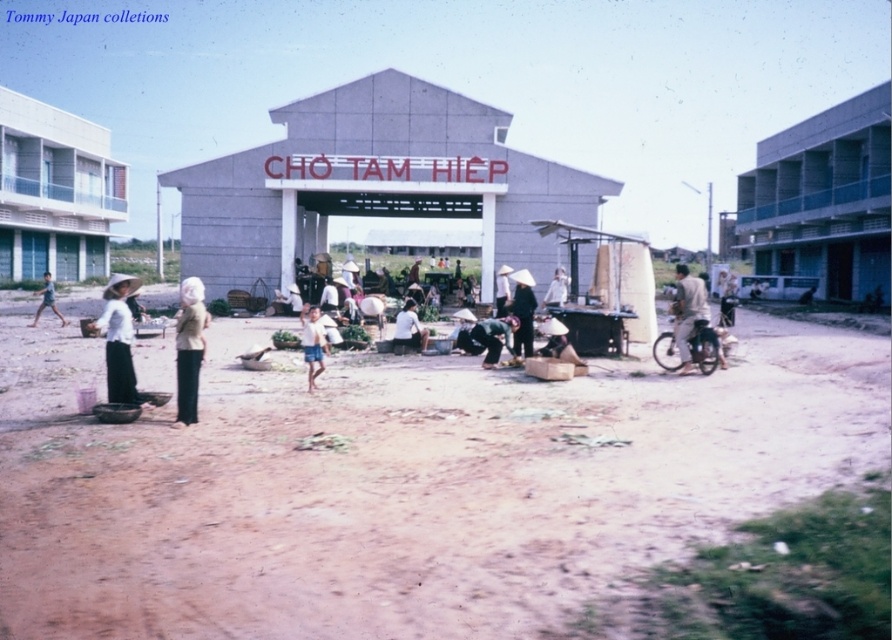
Question: Is brown dirt field at center to the left of dark brown fabric at center from the viewer's perspective?

Choices:
 (A) yes
 (B) no

Answer: (A)

Question: Which is farther from the brown dirt field at center?

Choices:
 (A) light brown fabric child at center
 (B) white cotton hat at center
 (C) matte white hat at center
 (D) matte black hat at center

Answer: (A)

Question: Considering the real-world distances, which object is farthest from the dark brown fabric at center?

Choices:
 (A) light brown fabric child at center
 (B) white cotton hat at center
 (C) light beige fabric headscarf at center
 (D) brown dirt field at center

Answer: (A)

Question: Which of the following is the farthest from the observer?

Choices:
 (A) (x=56, y=314)
 (B) (x=186, y=372)
 (C) (x=306, y=314)
 (D) (x=687, y=282)

Answer: (C)

Question: Can you confirm if brown dirt field at center is positioned to the right of matte white hat at center?

Choices:
 (A) no
 (B) yes

Answer: (A)

Question: Does light beige fabric headscarf at center appear on the right side of dark brown fabric at center?

Choices:
 (A) yes
 (B) no

Answer: (B)